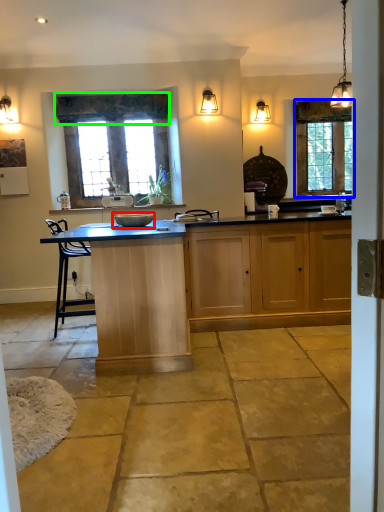
Question: Considering the real-world distances, which object is farthest from appliance (highlighted by a red box)? window (highlighted by a blue box) or curtain (highlighted by a green box)?

Choices:
 (A) window
 (B) curtain

Answer: (A)